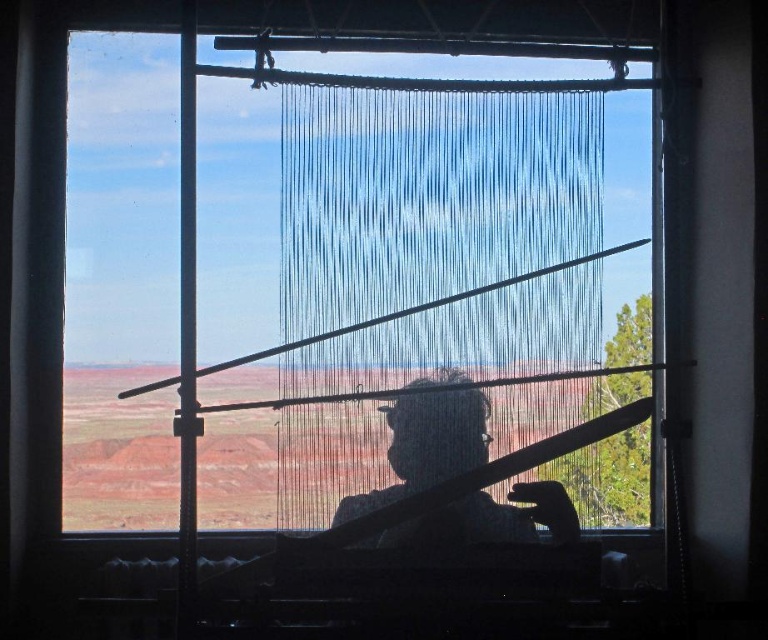
Is blue string curtain at center shorter than silhouette fabric at center?

Incorrect, blue string curtain at center's height does not fall short of silhouette fabric at center's.

Does blue string curtain at center appear over silhouette fabric at center?

Indeed, blue string curtain at center is positioned over silhouette fabric at center.

At what (x,y) coordinates should I click in order to perform the action: click on blue string curtain at center. Please return your answer as a coordinate pair (x, y). This screenshot has width=768, height=640. Looking at the image, I should click on (437, 234).

Who is more forward, [65,259] or [422,515]?

Point [422,515] is in front.

Does transparent glass window at center have a greater width compared to silhouette fabric at center?

Yes, transparent glass window at center is wider than silhouette fabric at center.

Does point (439, 72) lie in front of point (426, 484)?

No, (439, 72) is further to viewer.

Locate an element on the screen. transparent glass window at center is located at coordinates (121, 224).

Locate an element on the screen. The image size is (768, 640). blue string curtain at center is located at coordinates (437, 234).

Which is above, blue string curtain at center or transparent glass window at center?

transparent glass window at center is above.

Does point (316, 156) come behind point (257, 193)?

No, it is not.

Locate an element on the screen. The height and width of the screenshot is (640, 768). blue string curtain at center is located at coordinates (437, 234).